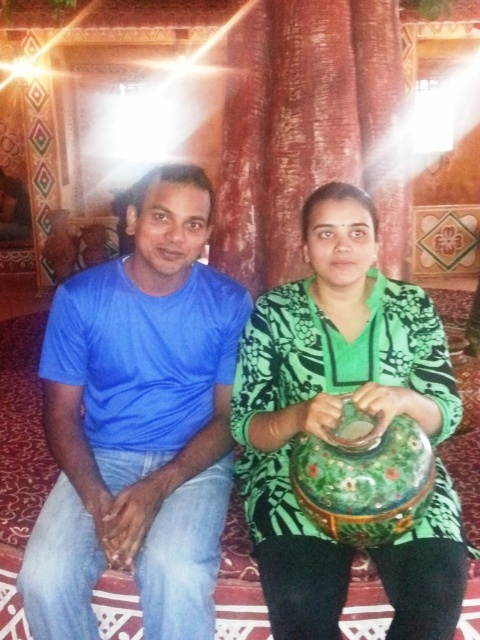
Question: Can you confirm if blue cotton shirt at left is positioned to the left of green floral dress at center?

Choices:
 (A) no
 (B) yes

Answer: (B)

Question: Is blue cotton shirt at left positioned at the back of green floral dress at center?

Choices:
 (A) no
 (B) yes

Answer: (B)

Question: Can you confirm if blue cotton shirt at left is bigger than green floral dress at center?

Choices:
 (A) no
 (B) yes

Answer: (A)